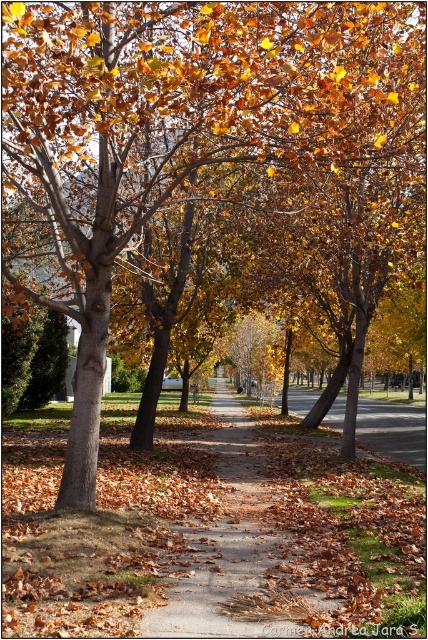
Which of these two, brown dirt path at center or brown asphalt at center, stands taller?

brown asphalt at center

Is point (252, 540) less distant than point (359, 440)?

Yes, it is in front of point (359, 440).

Between point (228, 618) and point (386, 426), which one is positioned behind?

The point (386, 426) is more distant.

Find the location of a particular element. brown dirt path at center is located at coordinates (225, 540).